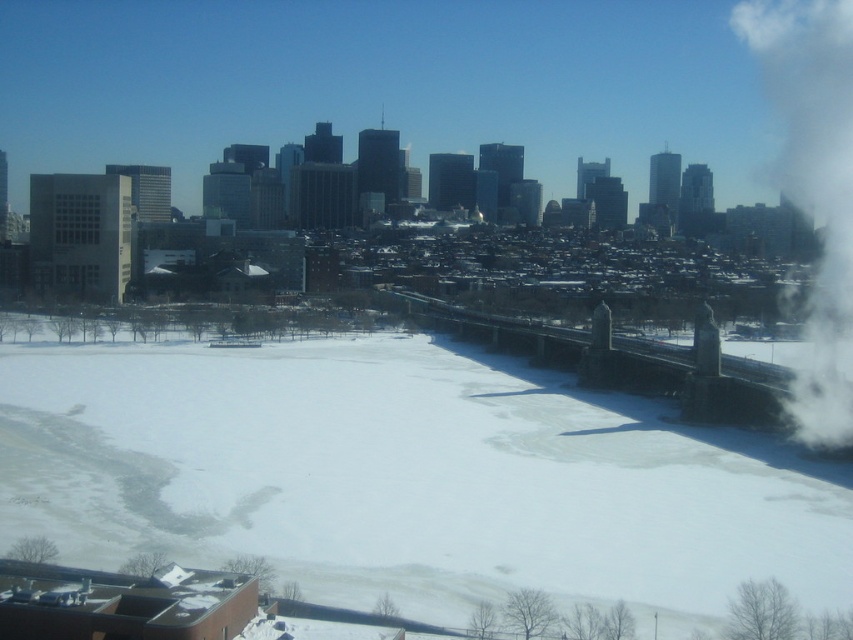
Is white powdery snow at center smaller than white smoke at upper right?

Yes, white powdery snow at center is smaller than white smoke at upper right.

Can you confirm if white powdery snow at center is positioned below white smoke at upper right?

Yes.

Identify the location of white powdery snow at center. (407, 477).

I want to click on white powdery snow at center, so click(407, 477).